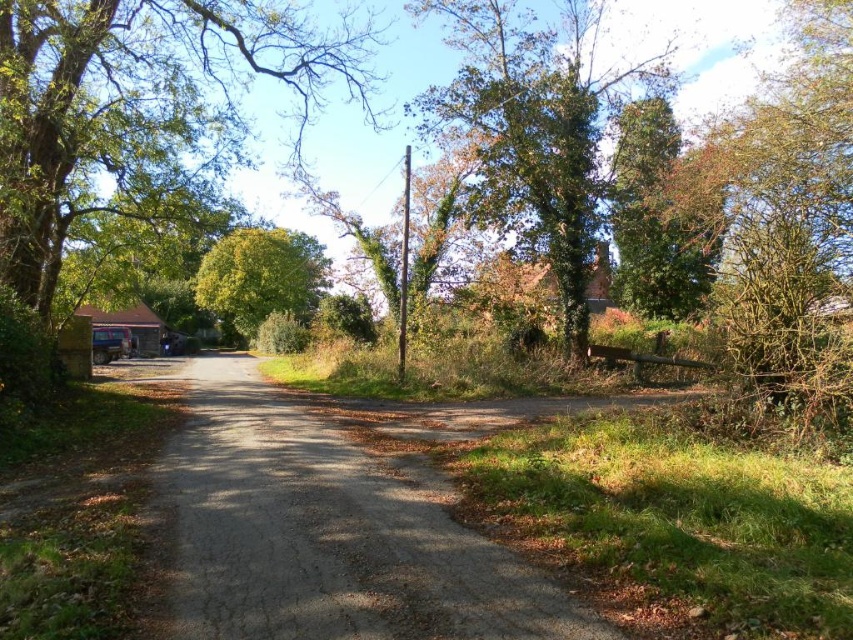
You are standing at the center of the dirt road and want to reach the red roofed building on the left. Which direction should you walk to avoid the green leafy tree at upper center?

The green leafy tree at upper center is located at point (527, 134), so you should walk to the right side of the dirt road to avoid it.

You are a delivery person driving a truck that is 2 meters wide. You need to navigate through the gray gravel road at center while avoiding the green leafy tree at center. Based on the scene, can your truck pass safely through the road?

The gray gravel road at center has a lesser width compared to green leafy tree at center. Since the truck is 2 meters wide, the road may not be wide enough to safely pass through without hitting the tree. It is recommended to find an alternative route or check the road width before proceeding.